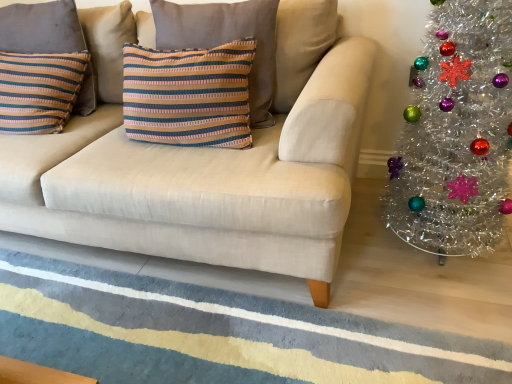
Locate an element on the screen. The image size is (512, 384). free region on the left part of tinsel silver christmas tree at right is located at coordinates (352, 259).